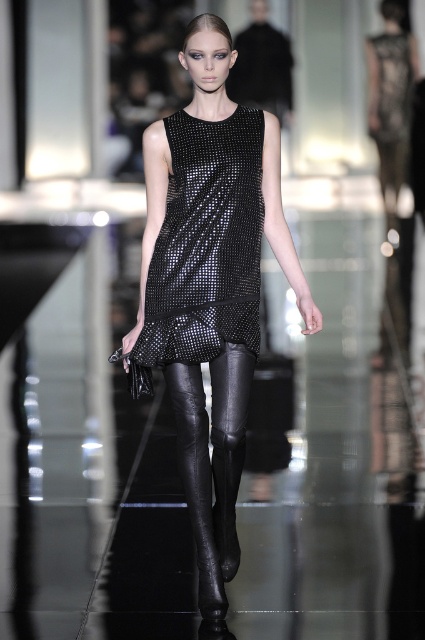
Can you confirm if black sequined dress at center is positioned below black leather tights at center?

Actually, black sequined dress at center is above black leather tights at center.

Does black sequined dress at center have a greater width compared to black leather tights at center?

Yes.

Between point (240, 212) and point (184, 376), which one is positioned in front?

Positioned in front is point (184, 376).

What are the coordinates of `black sequined dress at center` in the screenshot? It's located at (206, 243).

Which is more to the right, shiny black dress at center or black leather tights at center?

Positioned to the right is shiny black dress at center.

Does shiny black dress at center lie behind black leather tights at center?

No, shiny black dress at center is closer to the viewer.

Between point (210, 163) and point (204, 531), which one is positioned in front?

Point (204, 531)

Find the location of `shiny black dress at center`. shiny black dress at center is located at coordinates (210, 288).

From the picture: Is shiny black dress at center below black sequined dress at center?

Yes, shiny black dress at center is below black sequined dress at center.

Which is behind, point (238, 218) or point (221, 276)?

Positioned behind is point (221, 276).

Where is `shiny black dress at center`? This screenshot has height=640, width=425. shiny black dress at center is located at coordinates (210, 288).

Where is `shiny black dress at center`? The height and width of the screenshot is (640, 425). shiny black dress at center is located at coordinates (210, 288).